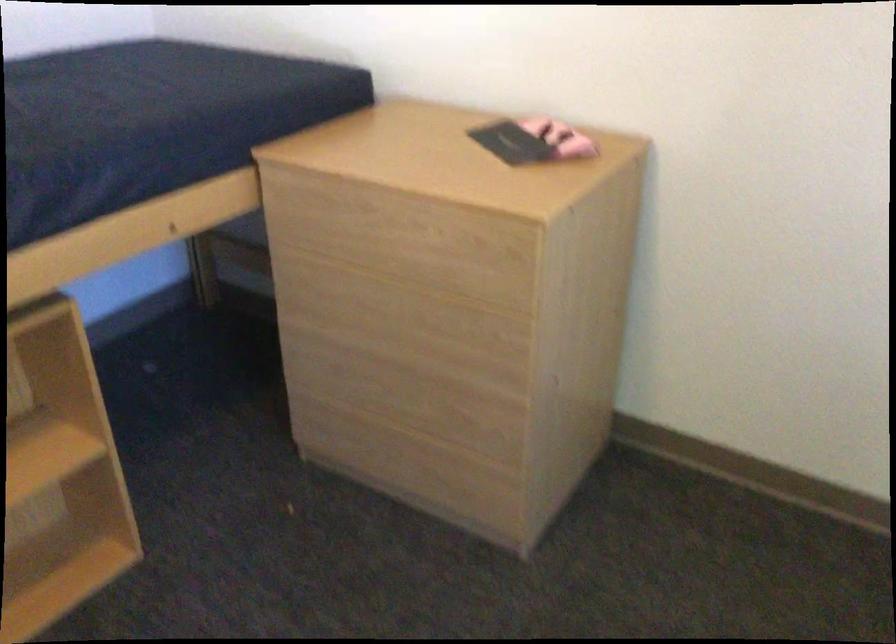
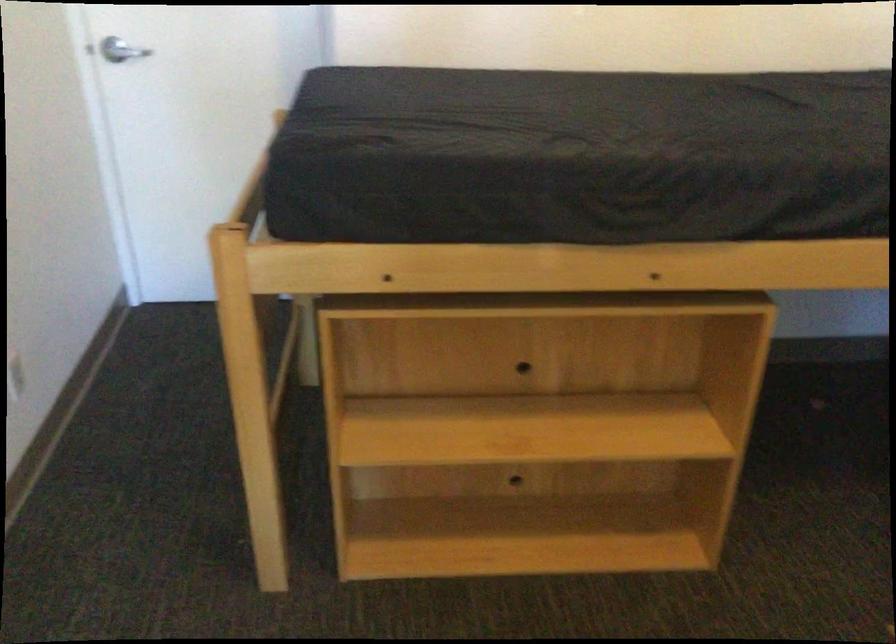
Question: The first image is from the beginning of the video and the second image is from the end. How did the camera likely rotate when shooting the video?

Choices:
 (A) Left
 (B) Right
 (C) Up
 (D) Down

Answer: (A)